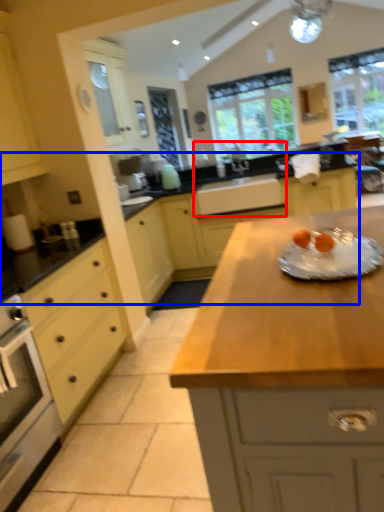
Question: Which object is closer to the camera taking this photo, sink (highlighted by a red box) or countertop (highlighted by a blue box)?

Choices:
 (A) sink
 (B) countertop

Answer: (B)